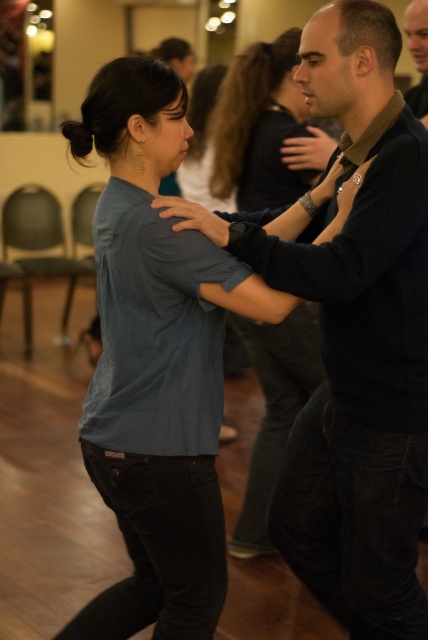
You are standing in the center of the room and want to move towards the smooth black shirt at upper right. Which direction should you move to avoid passing through the blue denim shirt at center?

The blue denim shirt at center is to the left of the smooth black shirt at upper right. To avoid passing through the blue denim shirt at center, you should move towards the right direction from your current position at the center.

You are a photographer setting up for a dance performance. You need to position your camera so that both the blue denim shirt at center and the smooth black shirt at upper right are visible. Based on their positions, which shirt should you focus on first to ensure both are in frame?

The blue denim shirt at center is located below the smooth black shirt at upper right. To ensure both are in frame, focus on the smooth black shirt at upper right first, as it is higher up, then adjust the camera angle downward to include the blue denim shirt at center.

In the scene shown: You are a photographer setting up a shoot in this dance studio. You need to place a backdrop that is 2 meters wide. The backdrop must be positioned between the blue denim shirt at center and the smooth black shirt at upper right. Given their sizes, will the backdrop fit comfortably between them?

The blue denim shirt at center is larger in size than smooth black shirt at upper right. The backdrop of 2 meters can fit comfortably between them as the distance between the two individuals is likely sufficient given their positioning in the dance studio.